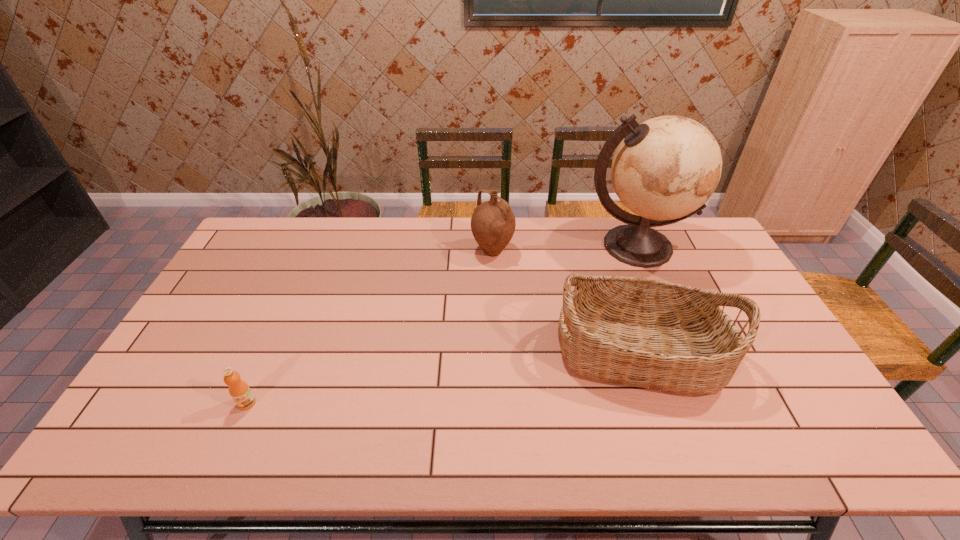
You are a GUI agent. You are given a task and a screenshot of the screen. Output one action in this format:
    pyautogui.click(x=<x>, y=<y>)
    Task: Click on the free space between the shortest object and the tallest object
    The height and width of the screenshot is (540, 960).
    Given the screenshot: What is the action you would take?
    pyautogui.click(x=442, y=325)

The width and height of the screenshot is (960, 540). In order to click on vacant space in between the pitcher and the orange juice in this screenshot , I will do `click(370, 327)`.

Identify the location of unoccupied position between the orange juice and the globe. This screenshot has width=960, height=540. (442, 325).

Locate which object ranks third in proximity to the tallest object. Please provide its 2D coordinates. Your answer should be formatted as a tuple, i.e. [(x, y)], where the tuple contains the x and y coordinates of a point satisfying the conditions above.

[(239, 390)]

This screenshot has width=960, height=540. I want to click on object identified as the second closest to the tallest object, so click(x=493, y=223).